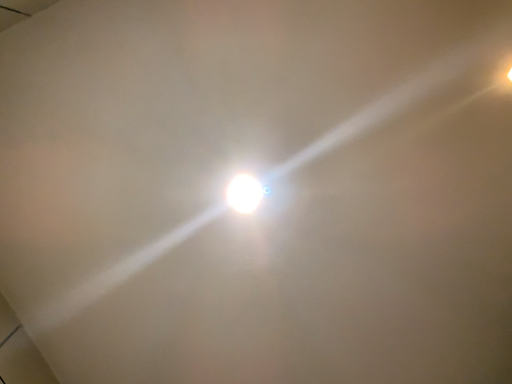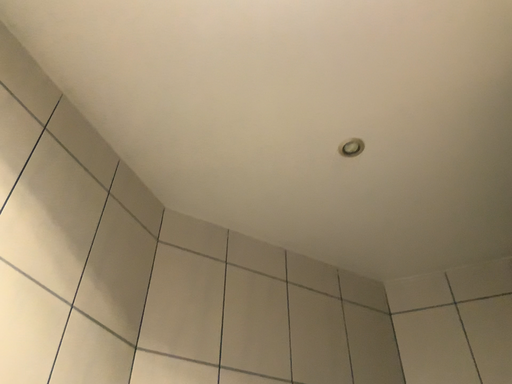
Question: How did the camera likely rotate when shooting the video?

Choices:
 (A) rotated upward
 (B) rotated downward

Answer: (B)